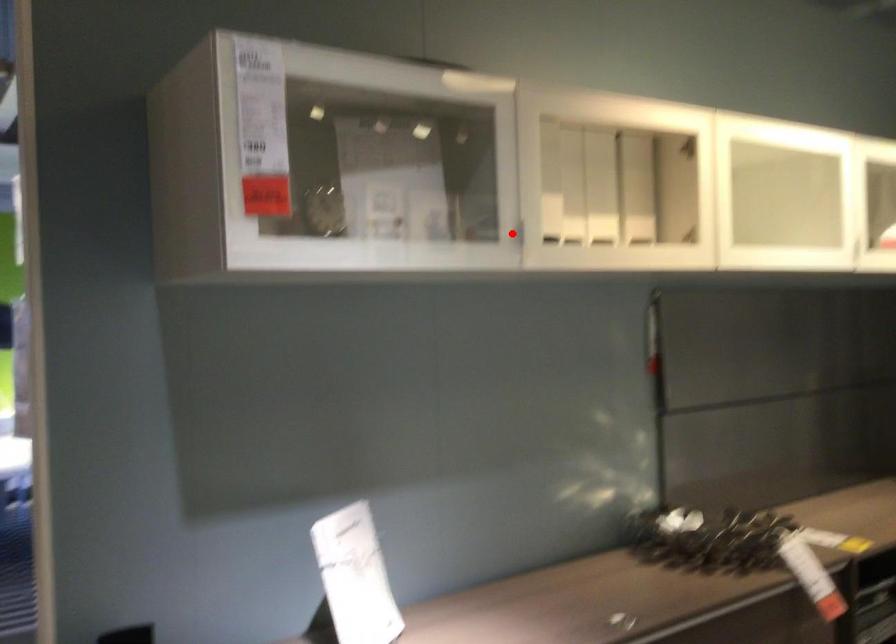
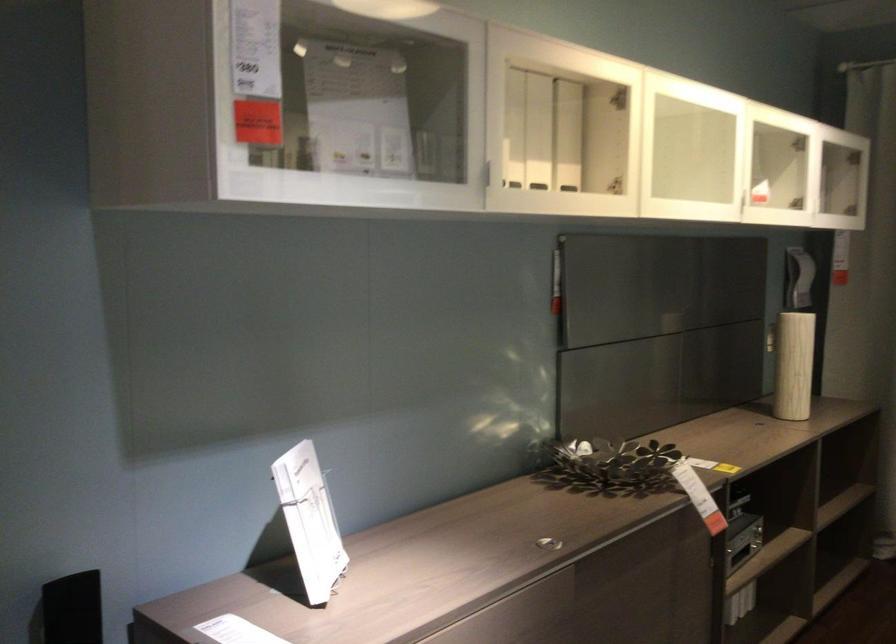
Locate, in the second image, the point that corresponds to the highlighted location in the first image.

(487, 174)